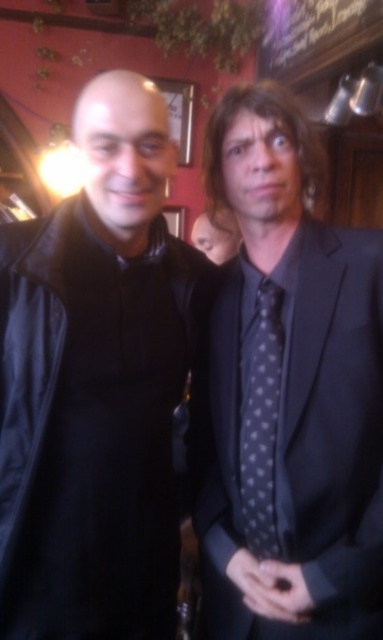
Who is positioned more to the right, polka dot silk tie at right or polka dot silk tie at center?

From the viewer's perspective, polka dot silk tie at right appears more on the right side.

Can you confirm if polka dot silk tie at right is positioned to the right of polka dot silk tie at center?

Yes, polka dot silk tie at right is to the right of polka dot silk tie at center.

Between point (379, 422) and point (270, 401), which one is positioned in front?

Positioned in front is point (379, 422).

The image size is (383, 640). What are the coordinates of `polka dot silk tie at right` in the screenshot? It's located at pos(289,392).

Is point (139, 456) farther from viewer compared to point (250, 353)?

That is False.

Is black leather jacket at left further to camera compared to polka dot silk tie at right?

That is False.

Which is behind, point (144, 204) or point (360, 417)?

The point (144, 204) is more distant.

I want to click on black leather jacket at left, so pyautogui.click(x=96, y=385).

Which is more to the right, black leather jacket at left or polka dot silk tie at center?

Positioned to the right is polka dot silk tie at center.

The height and width of the screenshot is (640, 383). Find the location of `black leather jacket at left`. black leather jacket at left is located at coordinates (96, 385).

Find the location of `black leather jacket at left`. black leather jacket at left is located at coordinates (96, 385).